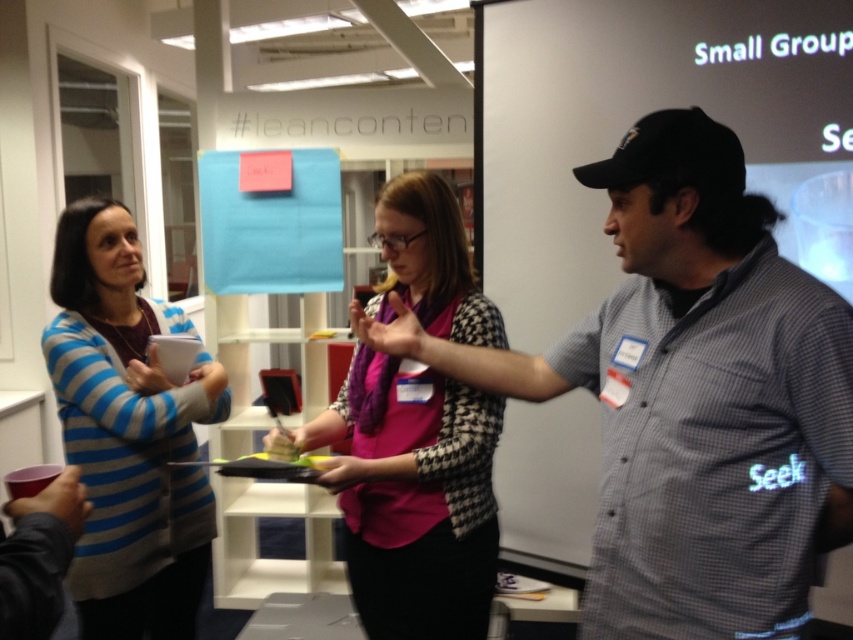
You are an interior designer assessing the spatial compatibility of two accessories in a room. The pink fabric scarf at center and the blue striped sweater at left are both placed on a shelf. If the shelf has a maximum weight capacity of 5 kilograms, and the scarf weighs 0.5 kilograms while the sweater weighs 2 kilograms, can both items be safely placed on the shelf together?

The pink fabric scarf at center weighs 0.5 kilograms and the blue striped sweater at left weighs 2 kilograms. Combined, they total 2.5 kilograms, which is under the 5 kilogram limit. Therefore, both items can be safely placed on the shelf together.

You are an observer in the room and want to know the relative positions of the pink fabric scarf at center and the blue striped sweater at left. Which one is more to the right?

The pink fabric scarf at center is more to the right than the blue striped sweater at left.